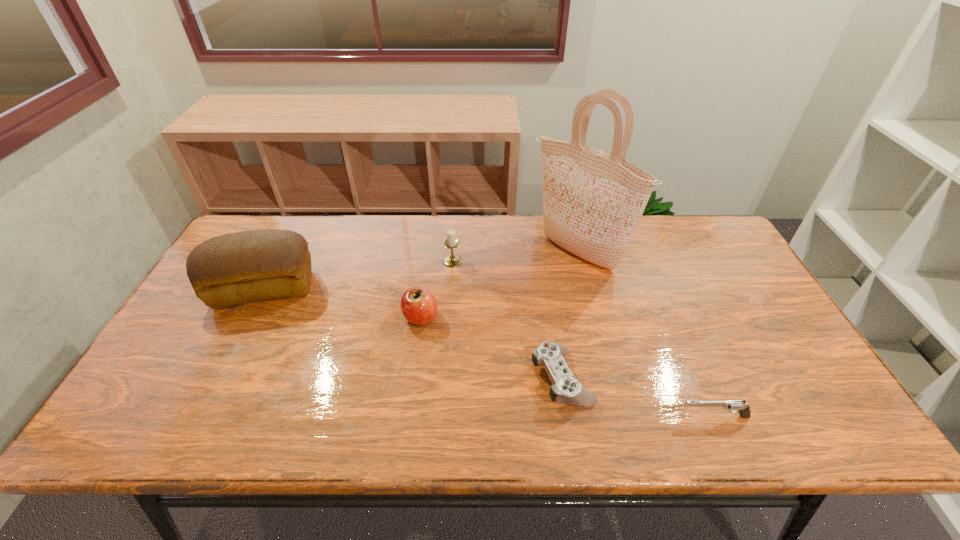
This screenshot has height=540, width=960. I want to click on free spot located on the right of the fourth tallest object, so click(460, 317).

At what (x,y) coordinates should I click in order to perform the action: click on vacant space located on the front-facing side of the pistol. Please return your answer as a coordinate pair (x, y). This screenshot has height=540, width=960. Looking at the image, I should click on (545, 416).

Identify the location of free space located on the front-facing side of the pistol. (572, 416).

Where is `free space located on the front-facing side of the pistol`? free space located on the front-facing side of the pistol is located at coordinates (621, 416).

This screenshot has height=540, width=960. What are the coordinates of `vacant space located on the left of the fifth farthest object` in the screenshot? It's located at (390, 378).

Identify the location of shopping bag at the far edge. (592, 202).

Locate an element on the screen. The image size is (960, 540). candle holder present at the far edge is located at coordinates (451, 242).

I want to click on pistol that is at the near edge, so click(x=734, y=406).

Locate an element on the screen. control that is positioned at the near edge is located at coordinates (566, 389).

Where is `object positioned at the left edge`? The width and height of the screenshot is (960, 540). object positioned at the left edge is located at coordinates (229, 270).